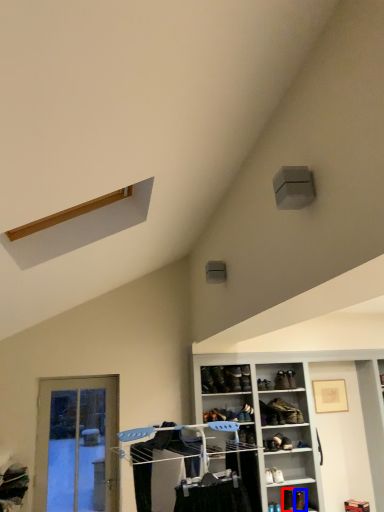
Question: Which object appears farthest to the camera in this image, shoe (highlighted by a red box) or shoe (highlighted by a blue box)?

Choices:
 (A) shoe
 (B) shoe

Answer: (A)